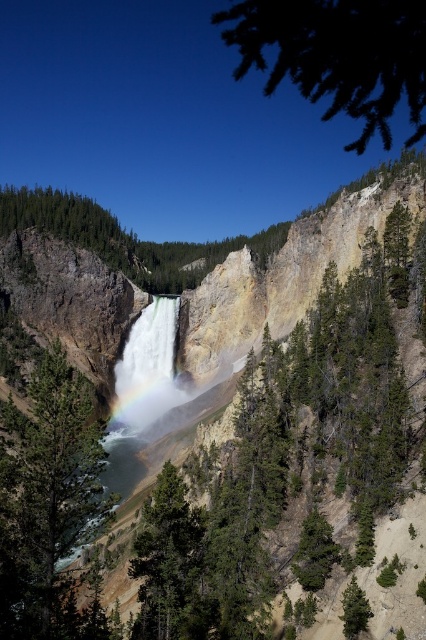
You are standing at the base of the waterfall and notice a green leafy branch at upper right and a green matte tree at lower right. Which object is nearer to you?

The green leafy branch at upper right is closer to the viewer than the green matte tree at lower right.

You are standing at the base of the waterfall and want to know the distance to the point marked at coordinates point (164,317). Can you determine how far it is from your current position to that point?

The distance between you and point (164,317) is 633.61 feet.